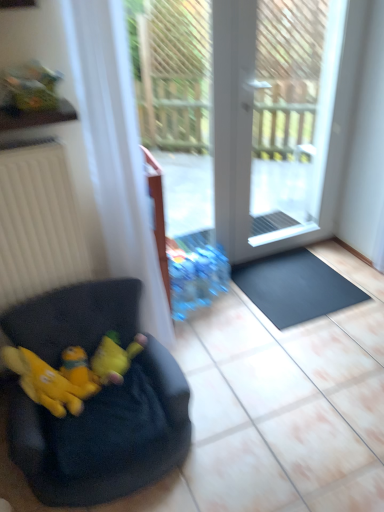
Question: Is yellow plush at left wider than yellow plush toy at lower left, which appears as the second animal when viewed from the right?

Choices:
 (A) yes
 (B) no

Answer: (B)

Question: From the image's perspective, is yellow plush at left under yellow plush toy at lower left, which appears as the second animal when viewed from the right?

Choices:
 (A) no
 (B) yes

Answer: (B)

Question: Can you confirm if yellow plush at left is shorter than yellow plush toy at lower left, which appears as the second animal when viewed from the right?

Choices:
 (A) yes
 (B) no

Answer: (A)

Question: Is there a large distance between yellow plush at left and yellow plush toy at lower left, which appears as the second animal when viewed from the right?

Choices:
 (A) no
 (B) yes

Answer: (A)

Question: From the image's perspective, is yellow plush at left located above yellow plush toy at lower left, which appears as the second animal when viewed from the right?

Choices:
 (A) no
 (B) yes

Answer: (A)

Question: Based on their positions, is black rubber doormat at lower right located to the left or right of black fabric bean bag at lower left?

Choices:
 (A) left
 (B) right

Answer: (B)

Question: Relative to black fabric bean bag at lower left, is black rubber doormat at lower right in front or behind?

Choices:
 (A) behind
 (B) front

Answer: (A)

Question: Looking at the image, does black rubber doormat at lower right seem bigger or smaller compared to black fabric bean bag at lower left?

Choices:
 (A) small
 (B) big

Answer: (A)

Question: Looking at their shapes, would you say black rubber doormat at lower right is wider or thinner than black fabric bean bag at lower left?

Choices:
 (A) wide
 (B) thin

Answer: (B)

Question: Is black rubber doormat at lower right taller or shorter than white sheer curtain at left?

Choices:
 (A) tall
 (B) short

Answer: (B)

Question: From the image's perspective, is black rubber doormat at lower right located above or below white sheer curtain at left?

Choices:
 (A) below
 (B) above

Answer: (A)

Question: Considering the relative positions of black rubber doormat at lower right and white sheer curtain at left in the image provided, is black rubber doormat at lower right to the left or to the right of white sheer curtain at left?

Choices:
 (A) right
 (B) left

Answer: (A)

Question: Is black rubber doormat at lower right wider or thinner than white sheer curtain at left?

Choices:
 (A) thin
 (B) wide

Answer: (B)

Question: Is point (129, 361) positioned closer to the camera than point (296, 27)?

Choices:
 (A) farther
 (B) closer

Answer: (B)

Question: Considering their positions, is yellow plush toy at lower left, marked as the 1th animal in a right-to-left arrangement, located in front of or behind white glass screen door at center?

Choices:
 (A) behind
 (B) front

Answer: (B)